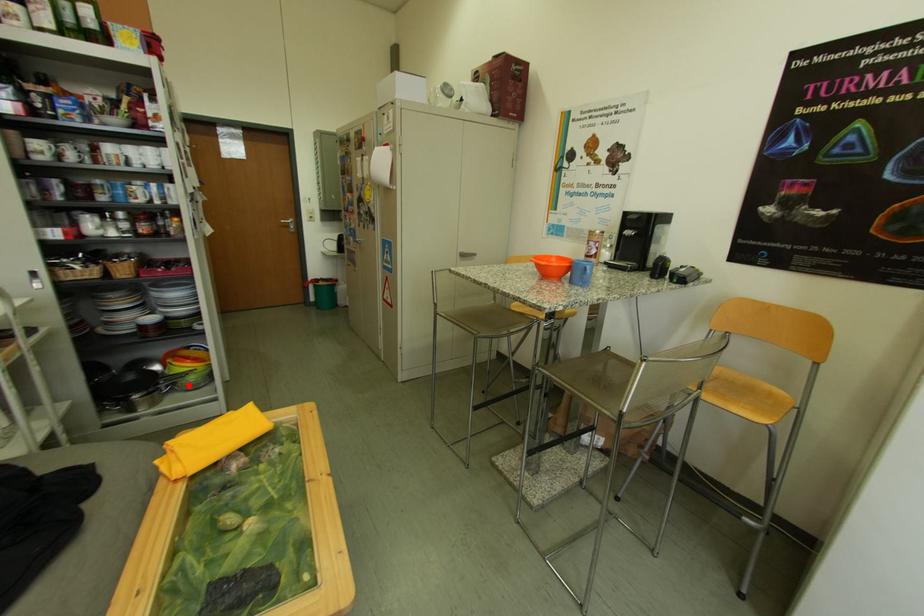
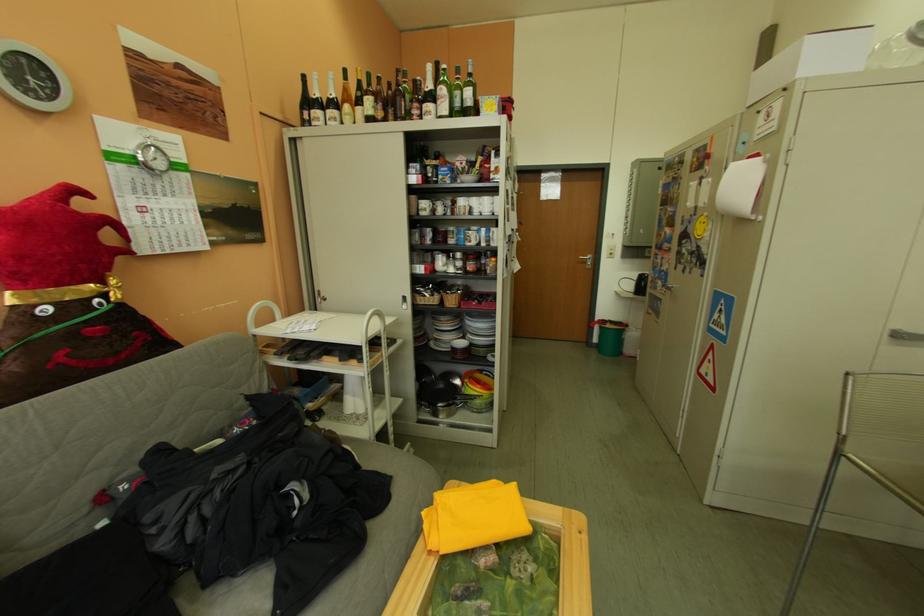
Question: I am providing you with two images of the same scene from different viewpoints. Given a red point in image1, look at the same physical point in image2. Is it:

Choices:
 (A) Closer to the viewpoint
 (B) Farther from the viewpoint

Answer: (B)